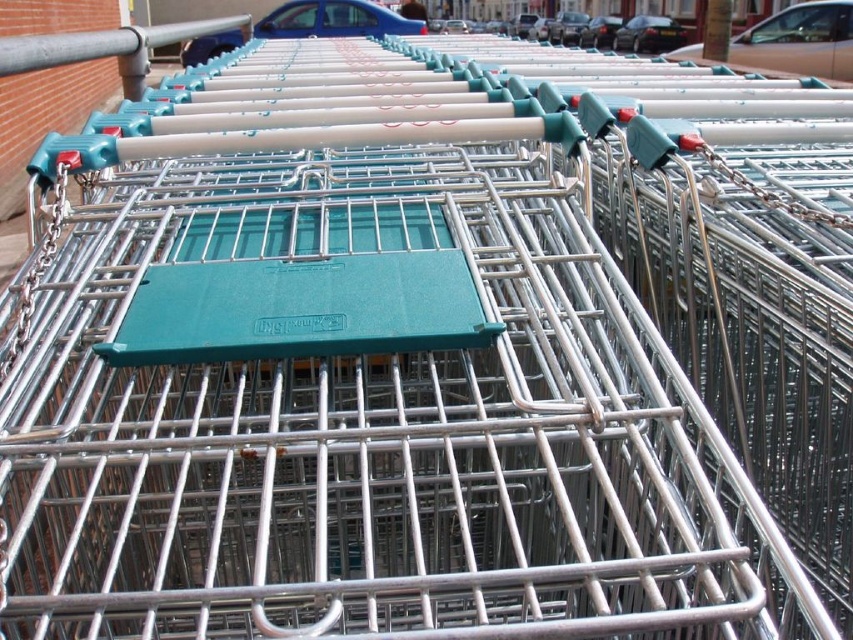
Question: Does blue metallic car at upper center appear on the left side of black glossy car at upper center?

Choices:
 (A) no
 (B) yes

Answer: (B)

Question: Which object appears farthest from the camera in this image?

Choices:
 (A) black glossy car at center
 (B) blue metallic car at upper center
 (C) brown matte car at upper center

Answer: (A)

Question: Which point is closer to the camera taking this photo?

Choices:
 (A) (642, 45)
 (B) (579, 44)
 (C) (216, 52)

Answer: (C)

Question: Estimate the real-world distances between objects in this image. Which object is farther from the black glossy car at upper center?

Choices:
 (A) black glossy car at center
 (B) blue metallic car at upper center
 (C) brown matte car at upper center

Answer: (B)

Question: Is blue metallic car at upper center positioned at the back of black glossy car at upper center?

Choices:
 (A) no
 (B) yes

Answer: (A)

Question: Is brown matte car at upper center wider than black glossy car at upper center?

Choices:
 (A) yes
 (B) no

Answer: (A)